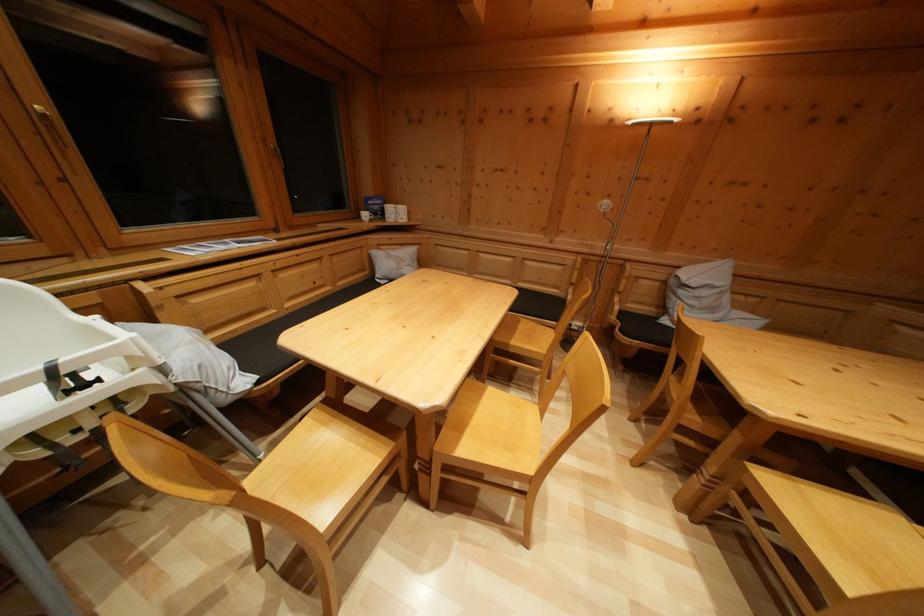
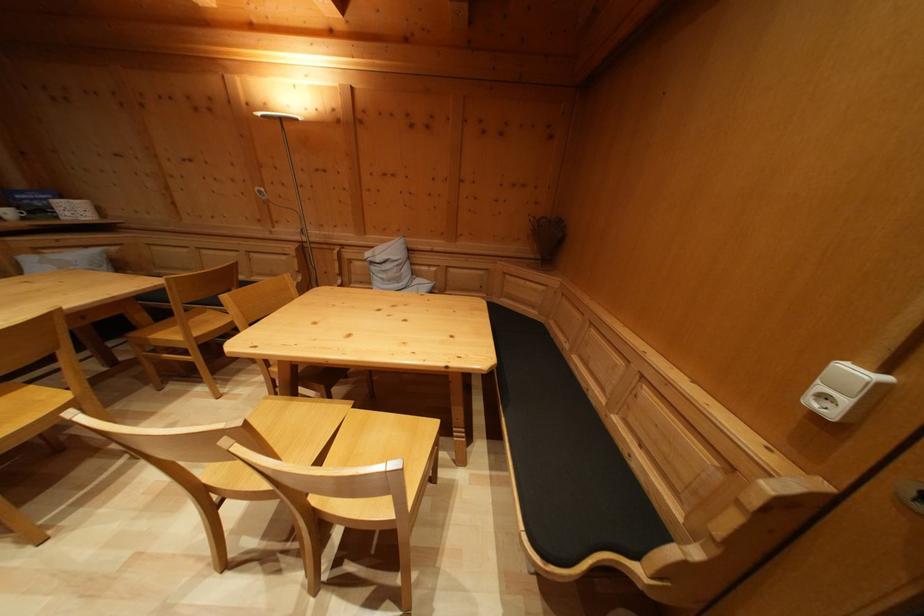
Locate, in the second image, the point that corresponds to pixel 371 222 in the first image.

(14, 219)